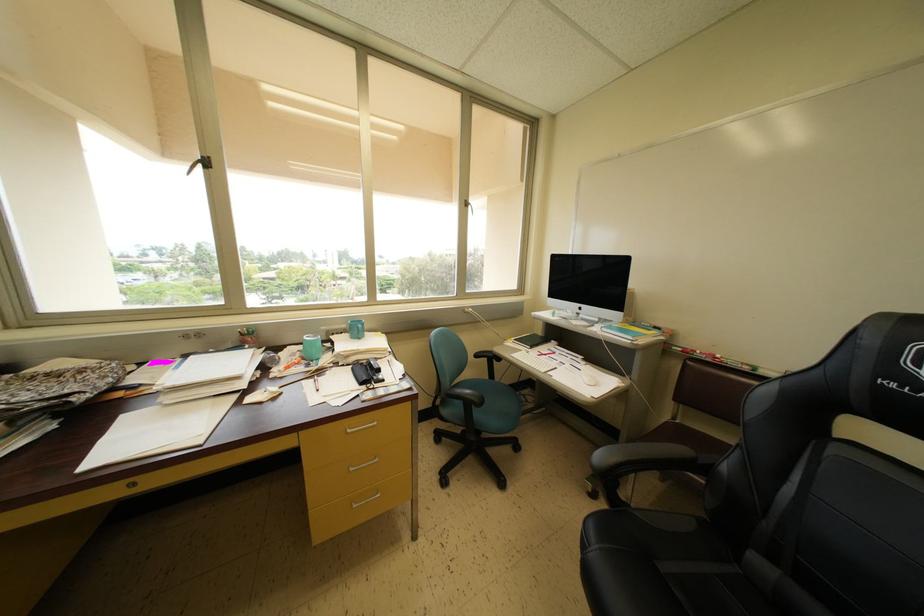
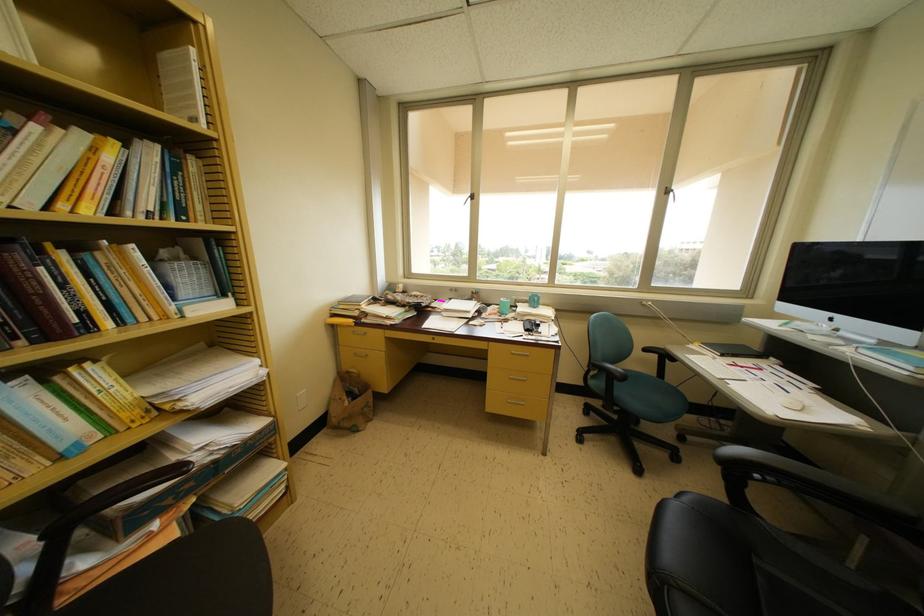
Find the pixel in the second image that matches (469,206) in the first image.

(671, 193)